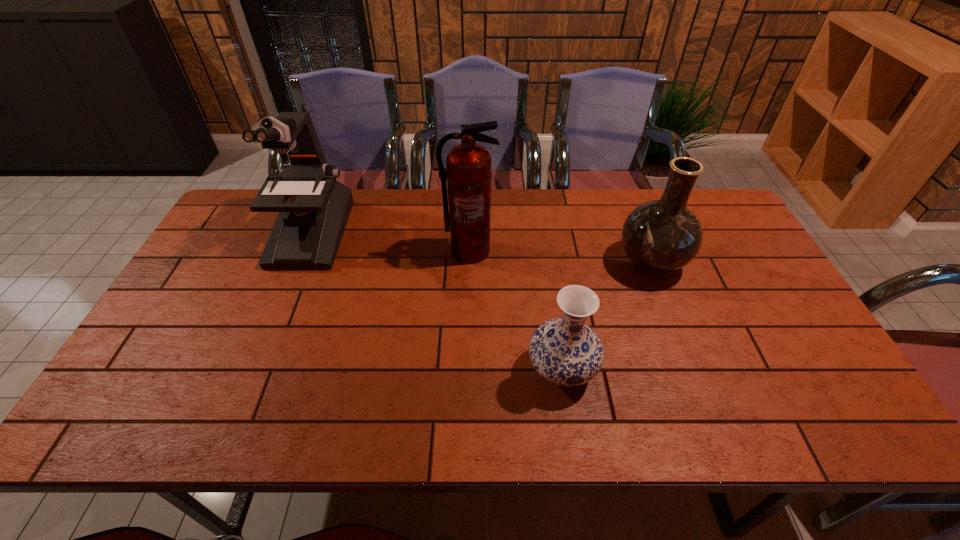
The height and width of the screenshot is (540, 960). Identify the location of fire extinguisher. (468, 173).

The width and height of the screenshot is (960, 540). Find the location of `microscope`. microscope is located at coordinates (314, 207).

At what (x,y) coordinates should I click in order to perform the action: click on the farther vase. Please return your answer as a coordinate pair (x, y). Image resolution: width=960 pixels, height=540 pixels. Looking at the image, I should click on (660, 236).

Where is `the right vase`? the right vase is located at coordinates (660, 236).

You are a GUI agent. You are given a task and a screenshot of the screen. Output one action in this format:
    pyautogui.click(x=<x>, y=<y>)
    Task: Click on the left vase
    This screenshot has height=540, width=960.
    Given the screenshot: What is the action you would take?
    pyautogui.click(x=565, y=351)

Identify the location of the nearest object. (565, 351).

Image resolution: width=960 pixels, height=540 pixels. Find the location of `vacant space located 0.390m on the nozzle side of the second object from left to right`. vacant space located 0.390m on the nozzle side of the second object from left to right is located at coordinates (467, 381).

The height and width of the screenshot is (540, 960). Find the location of `vacant region located through the eyepieces of the leftmost object`. vacant region located through the eyepieces of the leftmost object is located at coordinates (281, 304).

I want to click on blank space located 0.170m on the left of the third tallest object, so click(558, 262).

Where is `vacant area situated on the right of the second object from right to left`? The width and height of the screenshot is (960, 540). vacant area situated on the right of the second object from right to left is located at coordinates (684, 369).